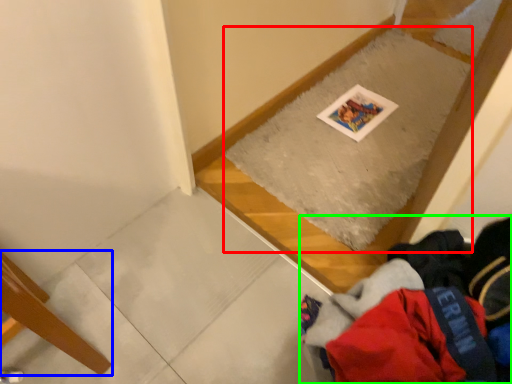
Question: Which object is positioned closest to mat (highlighted by a red box)? Select from furniture (highlighted by a blue box) and clothing (highlighted by a green box).

Choices:
 (A) furniture
 (B) clothing

Answer: (B)